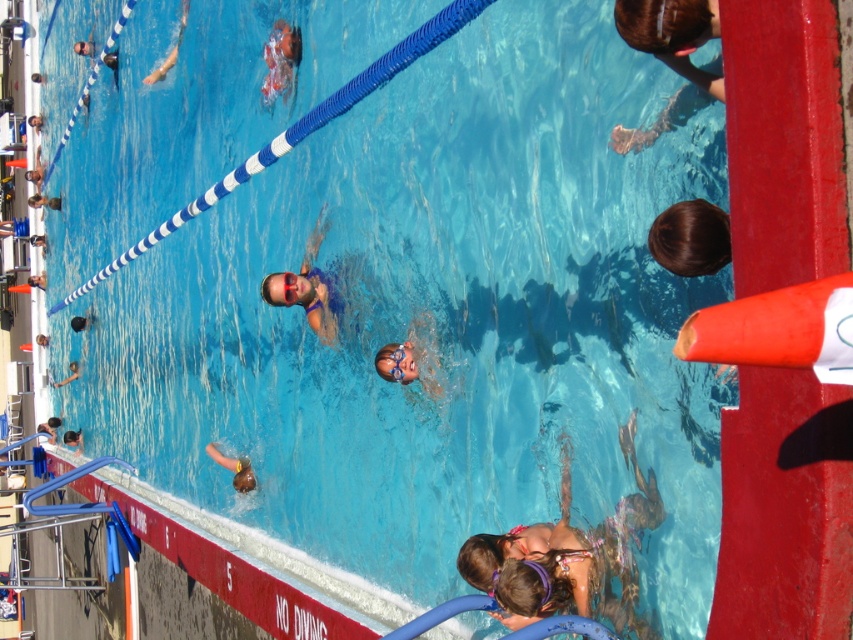
Question: Is brown hair at upper center thinner than smooth skin face at upper center?

Choices:
 (A) no
 (B) yes

Answer: (B)

Question: Is brown hair at upper center positioned behind smooth skin face at lower left?

Choices:
 (A) yes
 (B) no

Answer: (B)

Question: Based on their relative distances, which object is nearer to the smooth skin face at lower left?

Choices:
 (A) brown hair at upper right
 (B) matte yellow swim cap at lower center
 (C) brown hair at upper center
 (D) light pink fabric bikini at lower center

Answer: (B)

Question: Which point is farther to the camera?

Choices:
 (A) (71, 438)
 (B) (286, 32)
 (C) (666, 45)

Answer: (A)

Question: Which object appears farthest from the camera in this image?

Choices:
 (A) matte yellow swim cap at lower center
 (B) brown hair at upper right
 (C) light pink fabric bikini at lower center

Answer: (A)

Question: Can you confirm if light pink fabric bikini at lower center is positioned above smooth skin face at upper center?

Choices:
 (A) yes
 (B) no

Answer: (B)